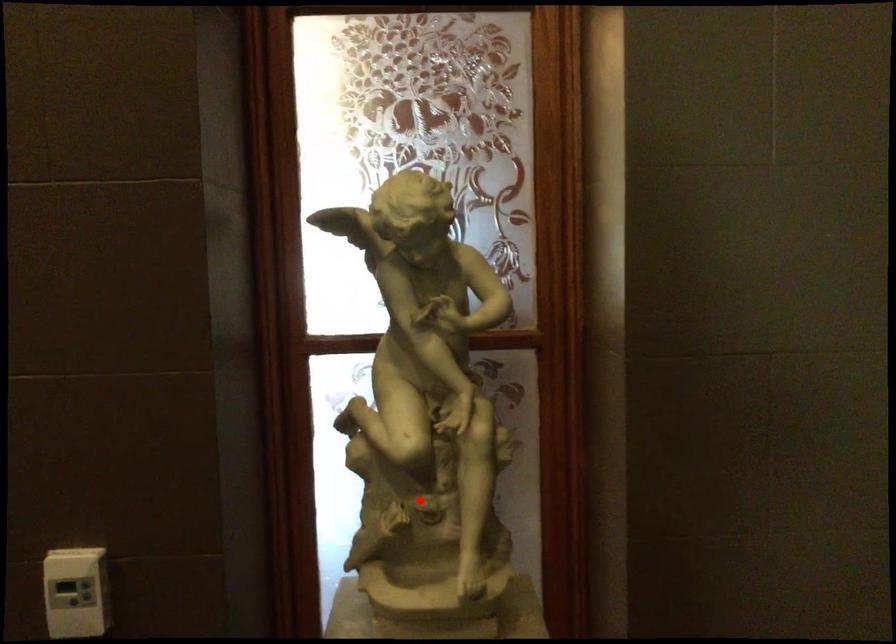
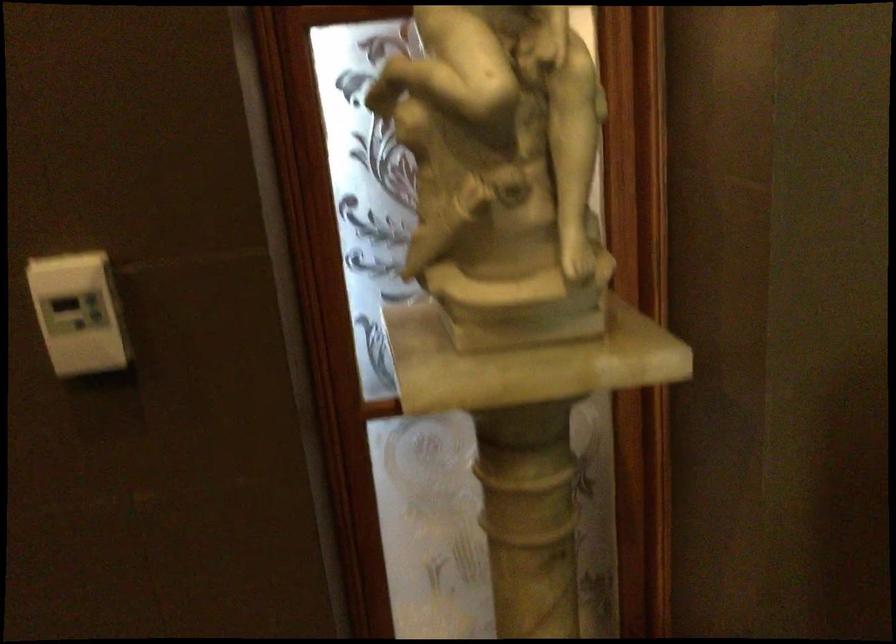
Question: I am providing you with two images of the same scene from different viewpoints. Image1 has a red point marked. In image2, the corresponding 3D location appears at what relative position? Reply with the corresponding letter.

Choices:
 (A) Closer
 (B) Farther

Answer: (A)